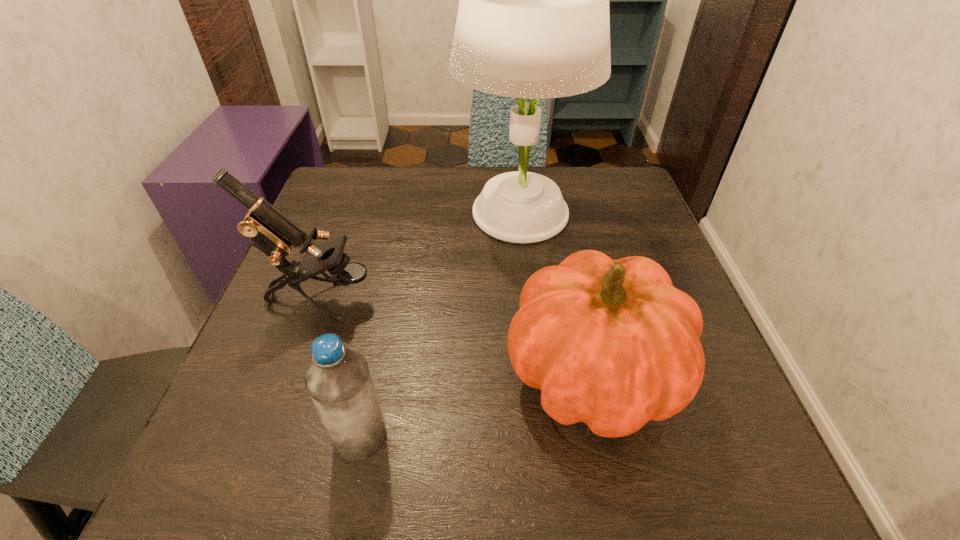
Locate an element on the screen. The width and height of the screenshot is (960, 540). free area in between the microscope and the farthest object is located at coordinates (420, 256).

Identify which object is the third closest to the pumpkin. Please provide its 2D coordinates. Your answer should be formatted as a tuple, i.e. [(x, y)], where the tuple contains the x and y coordinates of a point satisfying the conditions above.

[(270, 231)]

Locate which object ranks in proximity to the water bottle. Please provide its 2D coordinates. Your answer should be formatted as a tuple, i.e. [(x, y)], where the tuple contains the x and y coordinates of a point satisfying the conditions above.

[(612, 343)]

Identify the location of blank space that satisfies the following two spatial constraints: 1. through the eyepiece of the microscope; 2. on the right side of the water bottle. This screenshot has height=540, width=960. (273, 437).

Locate an element on the screen. vacant point that satisfies the following two spatial constraints: 1. on the front-facing side of the lamp; 2. on the front side of the shortest object is located at coordinates (542, 437).

At what (x,y) coordinates should I click in order to perform the action: click on free space in the image that satisfies the following two spatial constraints: 1. through the eyepiece of the microscope; 2. on the left side of the pumpkin. Please return your answer as a coordinate pair (x, y). Looking at the image, I should click on (295, 374).

The height and width of the screenshot is (540, 960). In order to click on free space that satisfies the following two spatial constraints: 1. on the front-facing side of the pumpkin; 2. on the right side of the lamp in this screenshot , I will do `click(536, 374)`.

You are a GUI agent. You are given a task and a screenshot of the screen. Output one action in this format:
    pyautogui.click(x=<x>, y=<y>)
    Task: Click on the vacant area in the image that satisfies the following two spatial constraints: 1. through the eyepiece of the microscope; 2. on the right side of the shortest object
    The image size is (960, 540).
    Given the screenshot: What is the action you would take?
    pyautogui.click(x=273, y=437)

Where is `free point that satisfies the following two spatial constraints: 1. through the eyepiece of the pumpkin; 2. on the right side of the microscope`? free point that satisfies the following two spatial constraints: 1. through the eyepiece of the pumpkin; 2. on the right side of the microscope is located at coordinates (295, 374).

Identify the location of vacant space that satisfies the following two spatial constraints: 1. on the back side of the pumpkin; 2. through the eyepiece of the microscope. (576, 300).